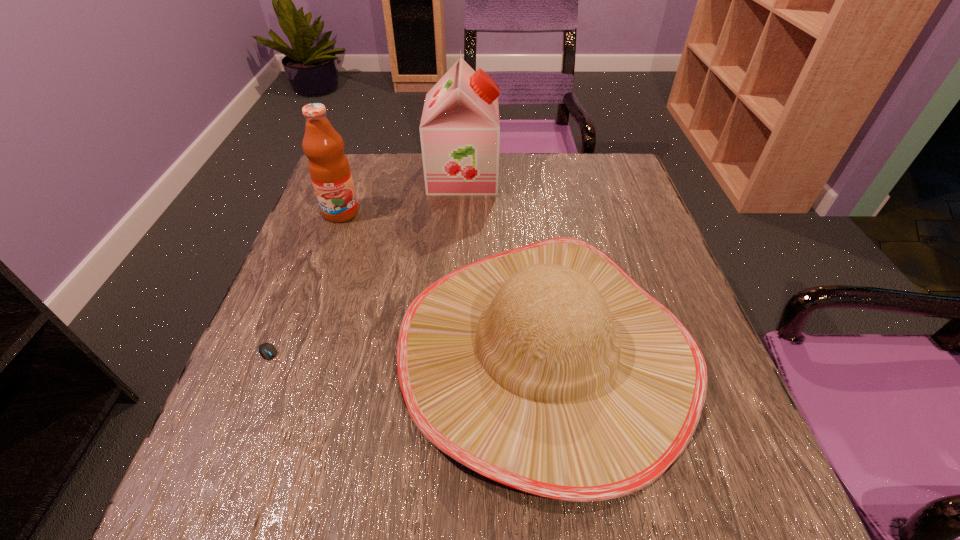
Find the location of a particular element. free point that satisfies the following two spatial constraints: 1. on the front label of the third nearest object; 2. on the right side of the sunhat is located at coordinates (290, 352).

You are a GUI agent. You are given a task and a screenshot of the screen. Output one action in this format:
    pyautogui.click(x=<x>, y=<y>)
    Task: Click on the free spot that satisfies the following two spatial constraints: 1. on the back side of the shortest object; 2. on the right side of the second shortest object
    The width and height of the screenshot is (960, 540).
    Given the screenshot: What is the action you would take?
    pyautogui.click(x=276, y=352)

At what (x,y) coordinates should I click in order to perform the action: click on vacant space that satisfies the following two spatial constraints: 1. with the cap open on the farthest object; 2. on the front label of the fruit juice. Please return your answer as a coordinate pair (x, y). The height and width of the screenshot is (540, 960). Looking at the image, I should click on (461, 213).

Locate an element on the screen. Image resolution: width=960 pixels, height=540 pixels. free location that satisfies the following two spatial constraints: 1. with the cap open on the farthest object; 2. on the left side of the sunhat is located at coordinates pyautogui.click(x=454, y=352).

Identify the location of vacant space that satisfies the following two spatial constraints: 1. on the front label of the sunhat; 2. on the left side of the fruit juice. This screenshot has height=540, width=960. (290, 352).

The height and width of the screenshot is (540, 960). What are the coordinates of `free region that satisfies the following two spatial constraints: 1. on the front label of the third tallest object; 2. on the right side of the fruit juice` in the screenshot? It's located at (290, 352).

At what (x,y) coordinates should I click in order to perform the action: click on free spot that satisfies the following two spatial constraints: 1. with the cap open on the third tallest object; 2. on the right side of the farthest object. Please return your answer as a coordinate pair (x, y). The width and height of the screenshot is (960, 540). Looking at the image, I should click on (454, 352).

Find the location of a particular element. vacant space that satisfies the following two spatial constraints: 1. with the cap open on the sunhat; 2. on the right side of the soya milk is located at coordinates (454, 352).

Identify the location of vacant area that satisfies the following two spatial constraints: 1. on the front label of the second farthest object; 2. on the left side of the sunhat. (290, 352).